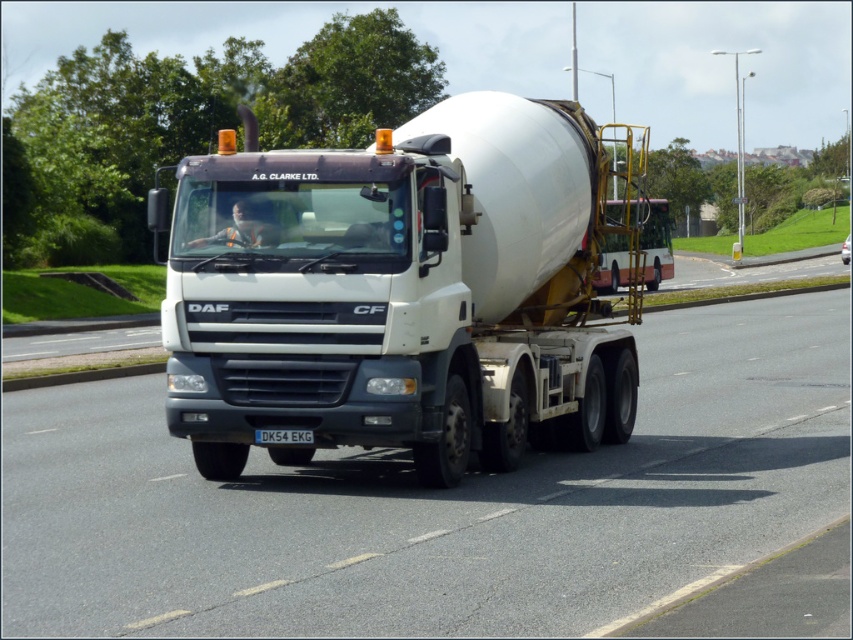
Question: Is white glossy concrete mixer truck at center to the right of white matte trailer truck at center from the viewer's perspective?

Choices:
 (A) yes
 (B) no

Answer: (A)

Question: Does white glossy concrete mixer truck at center appear under white matte trailer truck at center?

Choices:
 (A) no
 (B) yes

Answer: (B)

Question: Observing the image, what is the correct spatial positioning of white glossy concrete mixer truck at center in reference to white matte trailer truck at center?

Choices:
 (A) below
 (B) above

Answer: (A)

Question: Among these points, which one is farthest from the camera?

Choices:
 (A) (515, 609)
 (B) (312, 451)

Answer: (B)